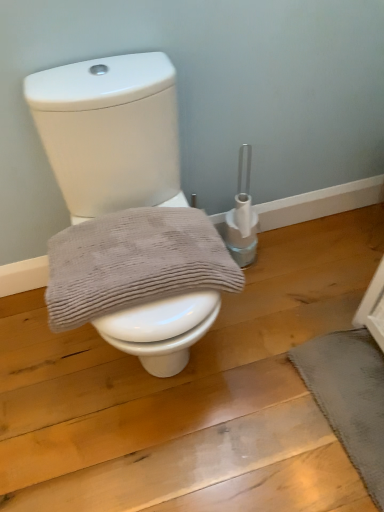
Where is `empty space that is ontop of gray textured towel at center (from a real-world perspective)`? This screenshot has width=384, height=512. empty space that is ontop of gray textured towel at center (from a real-world perspective) is located at coordinates (128, 254).